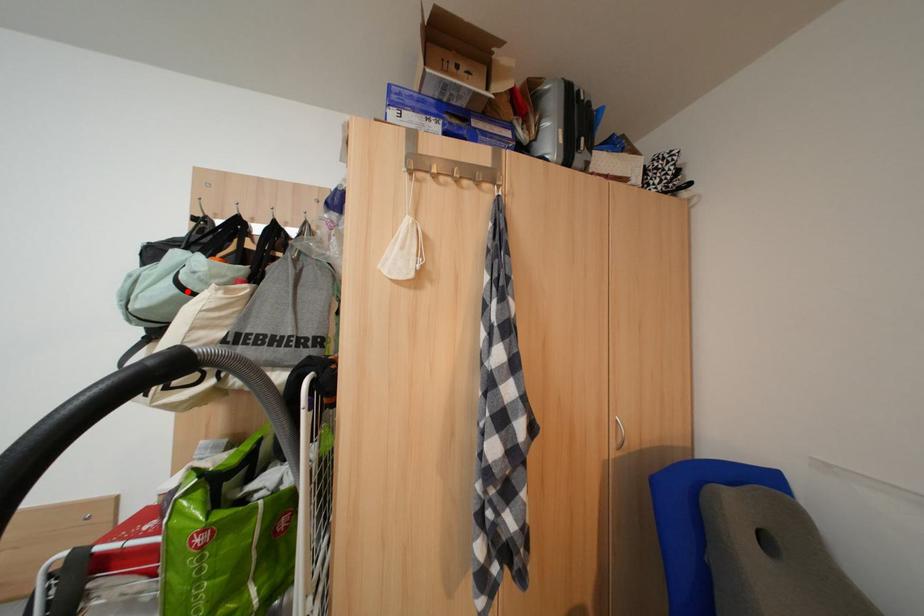
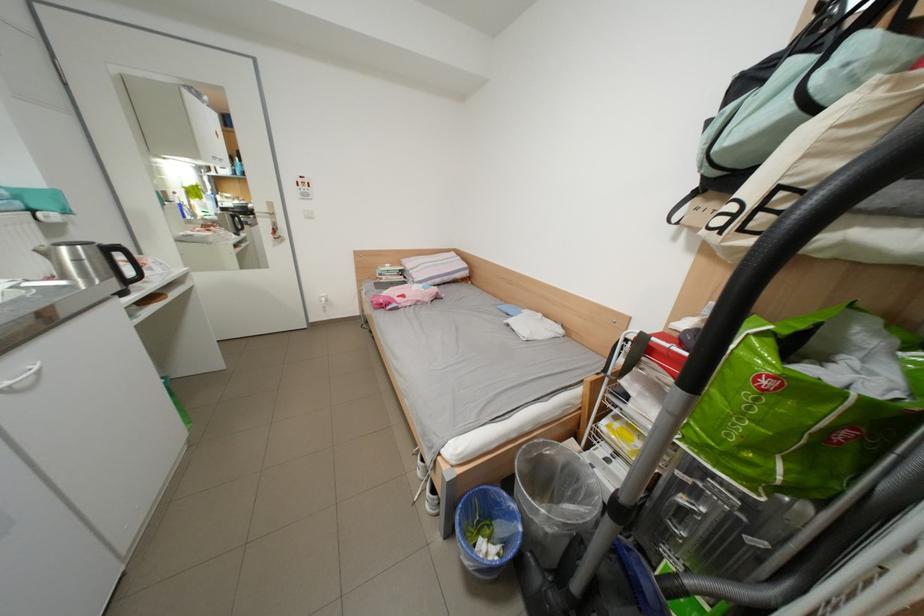
The point at the highlighted location is marked in the first image. Where is the corresponding point in the second image?

(801, 111)